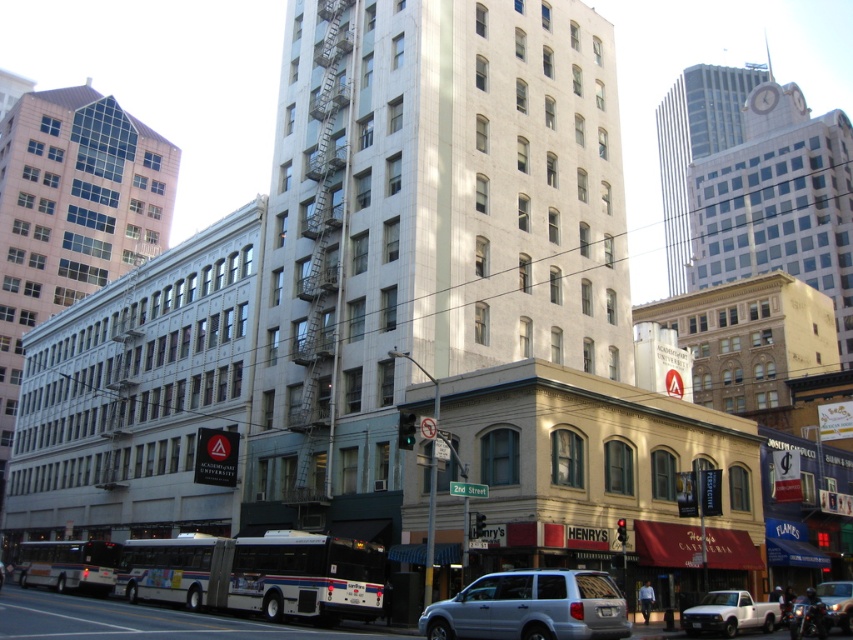
Question: Which point is closer to the camera?

Choices:
 (A) metallic silver car at center
 (B) white matte truck at lower right
 (C) silver metallic suv at lower center

Answer: (C)

Question: Is white matte truck at lower right to the left of metallic silver car at center from the viewer's perspective?

Choices:
 (A) yes
 (B) no

Answer: (A)

Question: Is white matte truck at lower right below metallic silver car at center?

Choices:
 (A) no
 (B) yes

Answer: (B)

Question: From the image, what is the correct spatial relationship of white matte truck at lower right in relation to metallic silver car at center?

Choices:
 (A) left
 (B) right

Answer: (A)

Question: Estimate the real-world distances between objects in this image. Which object is farther from the metallic silver car at center?

Choices:
 (A) silver metallic suv at lower center
 (B) white matte truck at lower right

Answer: (A)

Question: Which point appears farthest from the camera in this image?

Choices:
 (A) (622, 602)
 (B) (735, 608)
 (C) (844, 600)

Answer: (C)